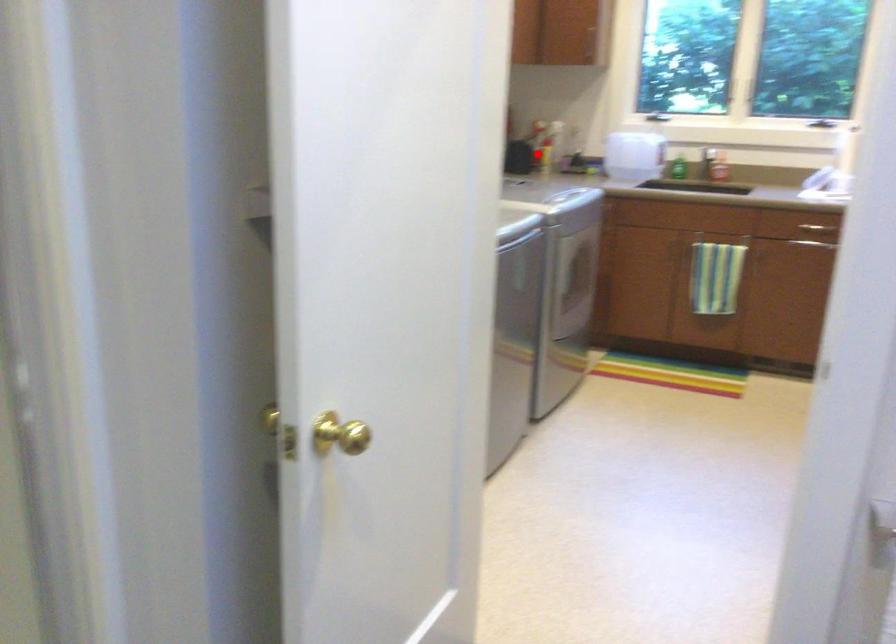
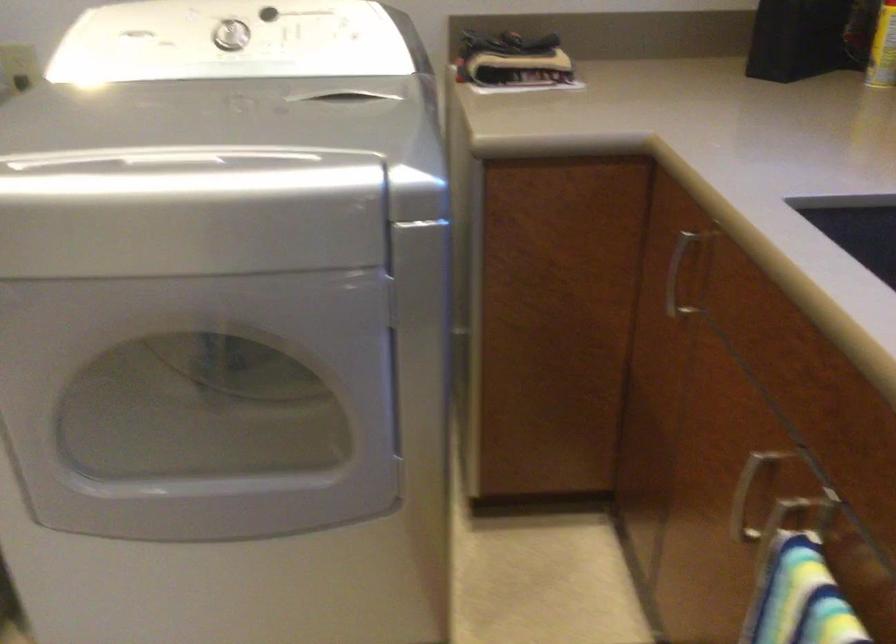
Question: I am providing you with two images of the same scene from different viewpoints. Image1 has a red point marked. In image2, the corresponding 3D location appears at what relative position? Reply with the corresponding letter.

Choices:
 (A) Closer
 (B) Farther

Answer: (A)